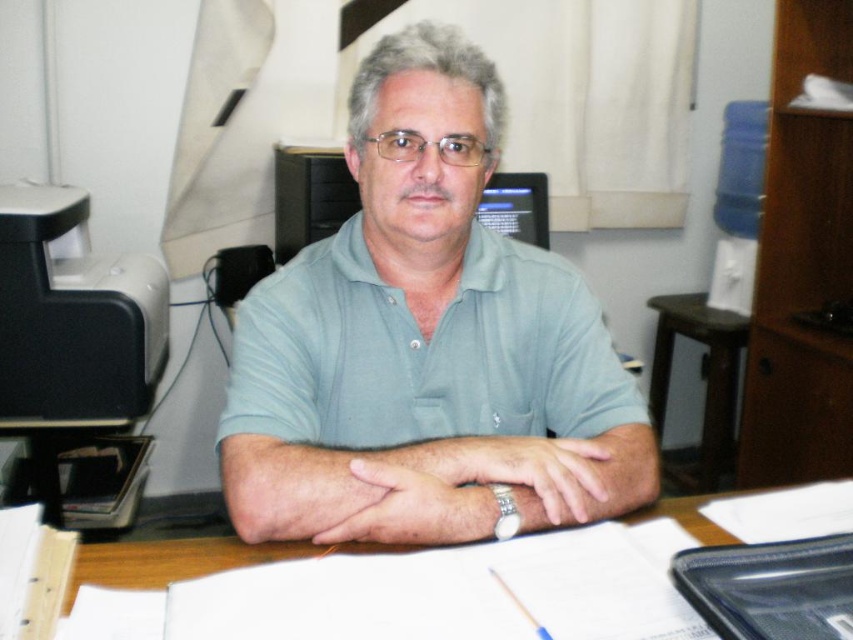
Can you confirm if light blue cotton shirt at center is thinner than wooden table at right?

No, light blue cotton shirt at center is not thinner than wooden table at right.

Does light blue cotton shirt at center appear on the left side of wooden table at right?

Yes, light blue cotton shirt at center is to the left of wooden table at right.

Locate an element on the screen. This screenshot has width=853, height=640. light blue cotton shirt at center is located at coordinates coord(426,344).

Locate an element on the screen. light blue cotton shirt at center is located at coordinates (426, 344).

Is wooden table at center to the right of wooden table at right from the viewer's perspective?

No, wooden table at center is not to the right of wooden table at right.

Is wooden table at center below wooden table at right?

Yes, wooden table at center is below wooden table at right.

Identify the location of wooden table at center. (421, 595).

Which of these two, light blue cotton shirt at center or wooden table at center, stands shorter?

wooden table at center is shorter.

Is point (412, 234) positioned before point (630, 602)?

That is False.

Where is `light blue cotton shirt at center`? The image size is (853, 640). light blue cotton shirt at center is located at coordinates (426, 344).